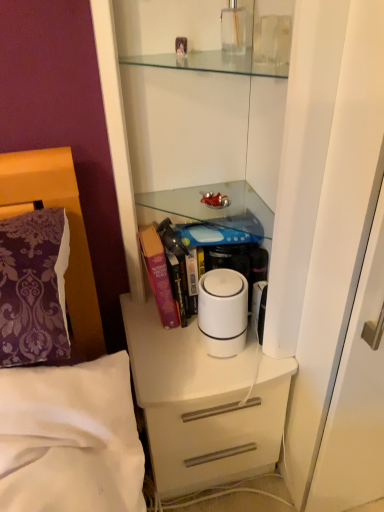
Locate an element on the screen. vacant space in front of white plastic humidifier at center is located at coordinates (216, 380).